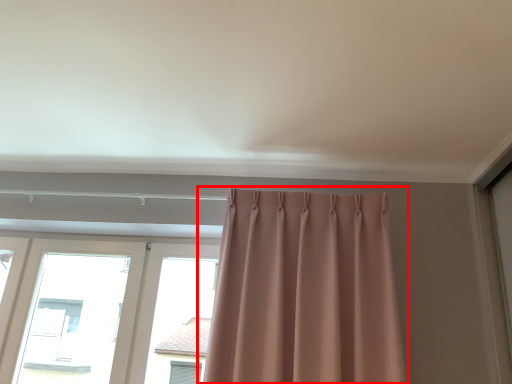
Question: Considering the relative positions of curtain (annotated by the red box) and window in the image provided, where is curtain (annotated by the red box) located with respect to the staircase?

Choices:
 (A) right
 (B) left

Answer: (A)